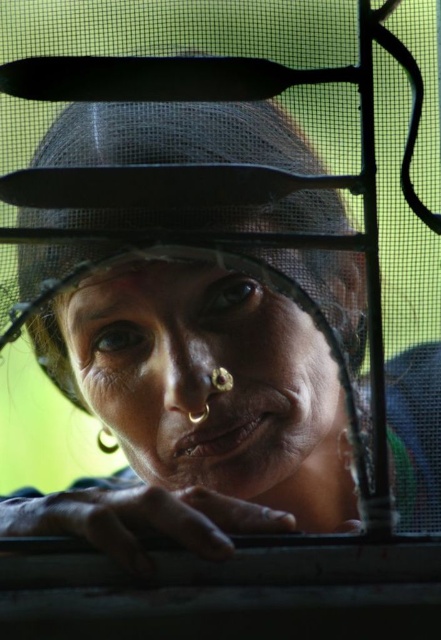
Question: Can you confirm if matte skin face at center is thinner than matte black hat at center?

Choices:
 (A) no
 (B) yes

Answer: (B)

Question: Can you confirm if matte skin face at center is thinner than matte black hat at center?

Choices:
 (A) no
 (B) yes

Answer: (B)

Question: Is matte skin face at center further to the viewer compared to matte black hat at center?

Choices:
 (A) yes
 (B) no

Answer: (A)

Question: Which of the following is the closest to the observer?

Choices:
 (A) matte skin face at center
 (B) matte black hat at center

Answer: (B)

Question: Which object appears closest to the camera in this image?

Choices:
 (A) matte skin face at center
 (B) matte black hat at center

Answer: (B)

Question: Which of the following is the closest to the observer?

Choices:
 (A) matte skin face at center
 (B) matte black hat at center

Answer: (B)